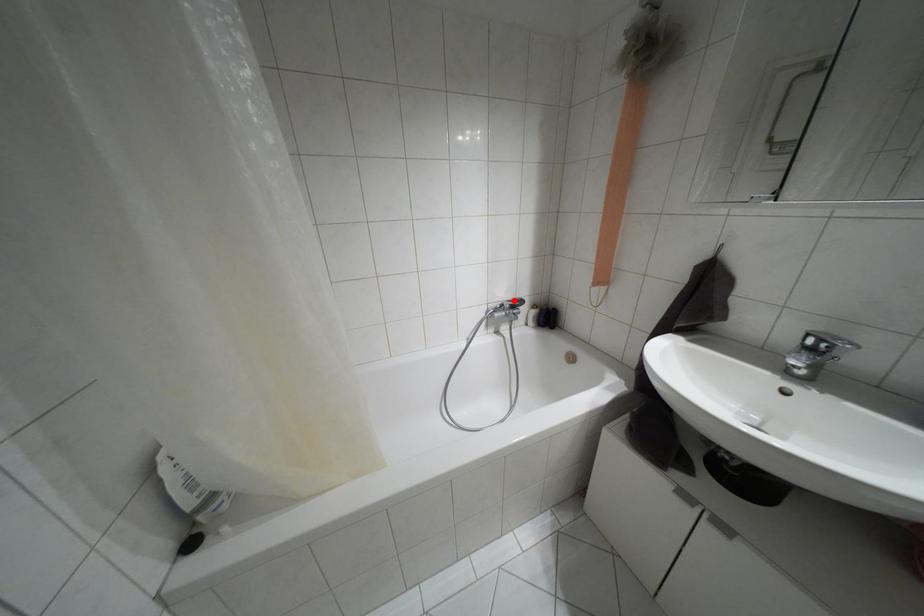
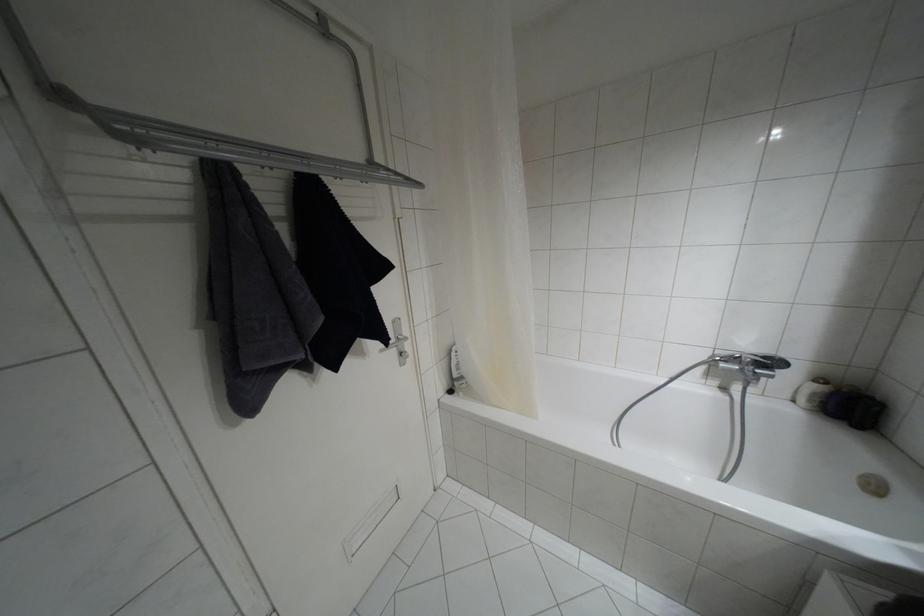
In the second image, find the point that corresponds to the highlighted location in the first image.

(763, 357)